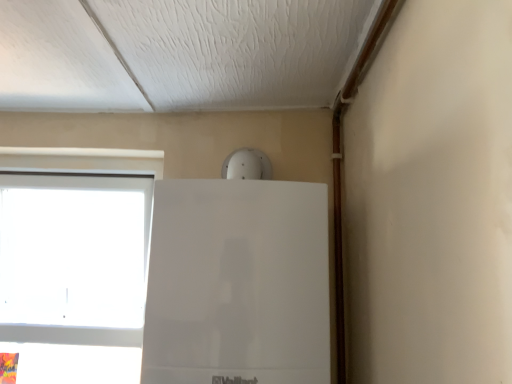
Question: In the image, is white plastic window at left positioned in front of or behind white glossy fridge at upper center?

Choices:
 (A) front
 (B) behind

Answer: (B)

Question: Considering the positions of white plastic window at left and white glossy fridge at upper center in the image, is white plastic window at left taller or shorter than white glossy fridge at upper center?

Choices:
 (A) tall
 (B) short

Answer: (A)

Question: From the image's perspective, is white plastic window at left located above or below white glossy fridge at upper center?

Choices:
 (A) below
 (B) above

Answer: (A)

Question: Would you say white glossy fridge at upper center is to the left or to the right of white plastic window at left in the picture?

Choices:
 (A) left
 (B) right

Answer: (B)

Question: In terms of height, does white glossy fridge at upper center look taller or shorter compared to white plastic window at left?

Choices:
 (A) tall
 (B) short

Answer: (B)

Question: Is white glossy fridge at upper center in front of or behind white plastic window at left in the image?

Choices:
 (A) behind
 (B) front

Answer: (B)

Question: Is white glossy fridge at upper center inside or outside of white plastic window at left?

Choices:
 (A) outside
 (B) inside

Answer: (A)